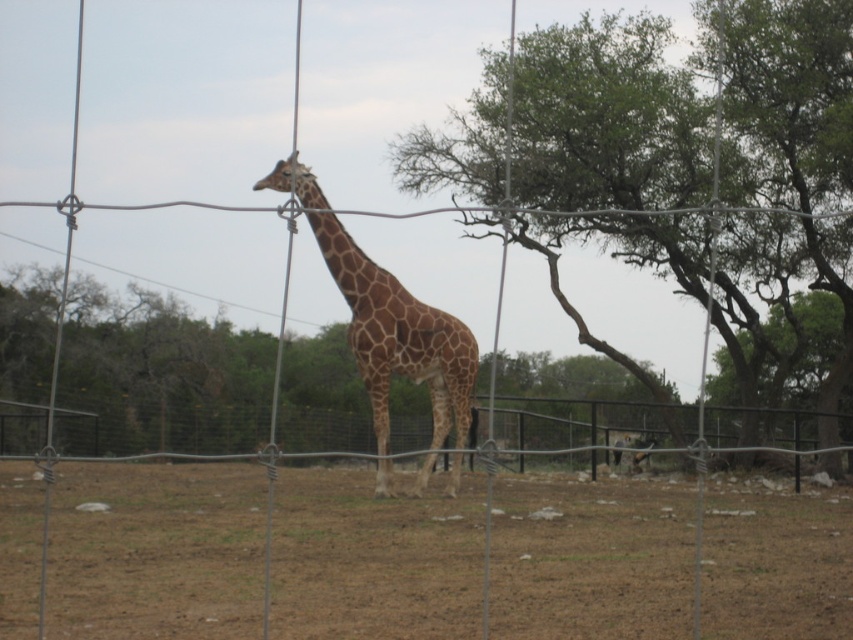
Question: Which point is farther from the camera taking this photo?

Choices:
 (A) (718, 445)
 (B) (567, 492)

Answer: (A)

Question: In this image, where is brown soil at center located relative to green leafy tree at center?

Choices:
 (A) right
 (B) left

Answer: (B)

Question: Which object is closer to the camera taking this photo?

Choices:
 (A) wire mesh fence at center
 (B) brown spotted giraffe at center
 (C) brown soil at center
 (D) green leafy tree at center

Answer: (A)

Question: Can you confirm if green leafy tree at center is thinner than brown spotted giraffe at center?

Choices:
 (A) no
 (B) yes

Answer: (A)

Question: Does wire mesh fence at center have a smaller size compared to brown spotted giraffe at center?

Choices:
 (A) no
 (B) yes

Answer: (A)

Question: Which point is farther to the camera?

Choices:
 (A) (386, 342)
 (B) (674, 100)
 (C) (106, 406)
 (D) (612, 628)

Answer: (C)